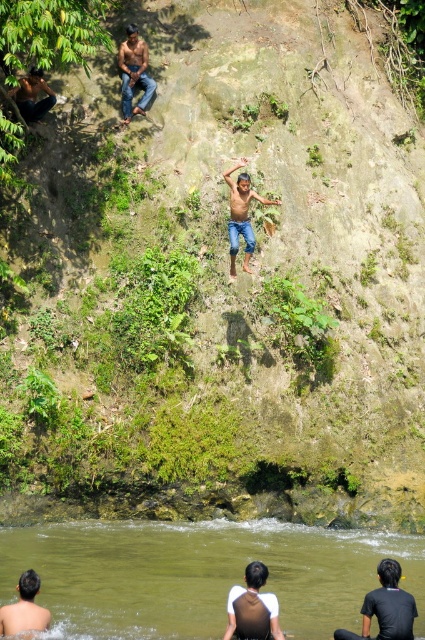
Question: Which of the following is the closest to the observer?

Choices:
 (A) (246, 176)
 (B) (139, 77)
 (C) (14, 97)

Answer: (A)

Question: Is green smooth water at lower center smaller than brown skin child at center?

Choices:
 (A) no
 (B) yes

Answer: (B)

Question: Which is nearer to the brown skin man at lower left?

Choices:
 (A) dark brown hair at lower right
 (B) brown leather jacket at upper left
 (C) green smooth water at lower center
 (D) jeans at upper center

Answer: (C)

Question: Does brown skin child at center have a lesser width compared to brown leather jacket at upper left?

Choices:
 (A) yes
 (B) no

Answer: (B)

Question: Which point is closer to the camera?

Choices:
 (A) green smooth water at lower center
 (B) brown leather jacket at upper left

Answer: (A)

Question: Can you confirm if green smooth water at lower center is bigger than dark brown hair at lower right?

Choices:
 (A) yes
 (B) no

Answer: (A)